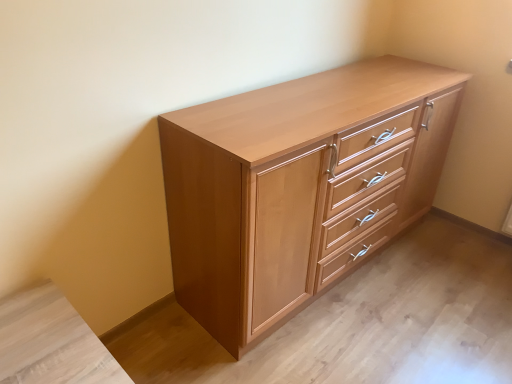
Question: Is light brown wood chest of drawers at center oriented towards light brown wood vanity at lower left?

Choices:
 (A) yes
 (B) no

Answer: (B)

Question: Can you confirm if light brown wood chest of drawers at center is smaller than light brown wood vanity at lower left?

Choices:
 (A) yes
 (B) no

Answer: (B)

Question: Does light brown wood chest of drawers at center have a lesser height compared to light brown wood vanity at lower left?

Choices:
 (A) no
 (B) yes

Answer: (A)

Question: From a real-world perspective, is light brown wood chest of drawers at center under light brown wood vanity at lower left?

Choices:
 (A) no
 (B) yes

Answer: (A)

Question: Does light brown wood chest of drawers at center touch light brown wood vanity at lower left?

Choices:
 (A) yes
 (B) no

Answer: (B)

Question: From the image's perspective, is light brown wood chest of drawers at center over light brown wood vanity at lower left?

Choices:
 (A) yes
 (B) no

Answer: (A)

Question: Does light brown wood vanity at lower left appear on the left side of light brown wood chest of drawers at center?

Choices:
 (A) no
 (B) yes

Answer: (B)

Question: Would you say light brown wood vanity at lower left is a long distance from light brown wood chest of drawers at center?

Choices:
 (A) yes
 (B) no

Answer: (B)

Question: Can you confirm if light brown wood vanity at lower left is bigger than light brown wood chest of drawers at center?

Choices:
 (A) yes
 (B) no

Answer: (B)

Question: From the image's perspective, would you say light brown wood vanity at lower left is shown under light brown wood chest of drawers at center?

Choices:
 (A) no
 (B) yes

Answer: (B)

Question: Does light brown wood vanity at lower left have a smaller size compared to light brown wood chest of drawers at center?

Choices:
 (A) yes
 (B) no

Answer: (A)

Question: Is the position of light brown wood vanity at lower left less distant than that of light brown wood chest of drawers at center?

Choices:
 (A) no
 (B) yes

Answer: (B)

Question: From the image's perspective, is light brown wood chest of drawers at center positioned above or below light brown wood vanity at lower left?

Choices:
 (A) above
 (B) below

Answer: (A)